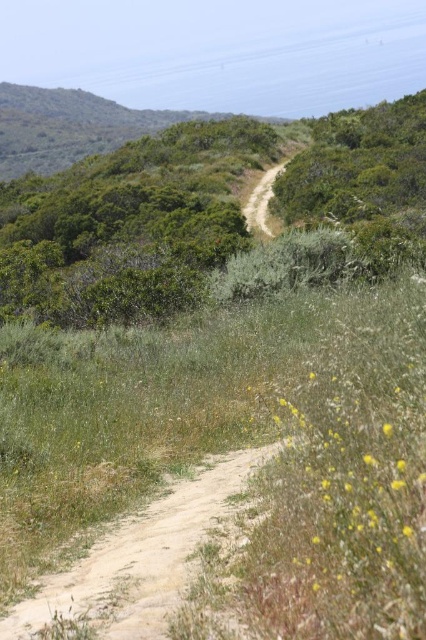
Question: In this image, where is green leafy shrubs at upper left located relative to dirt path at center?

Choices:
 (A) below
 (B) above

Answer: (A)

Question: Is green leafy shrubs at upper left to the left of dirt path at center from the viewer's perspective?

Choices:
 (A) yes
 (B) no

Answer: (A)

Question: Which object appears farthest from the camera in this image?

Choices:
 (A) green leafy shrubs at upper left
 (B) dirt path at center

Answer: (B)

Question: Is green leafy shrubs at upper left closer to camera compared to dirt path at center?

Choices:
 (A) yes
 (B) no

Answer: (A)